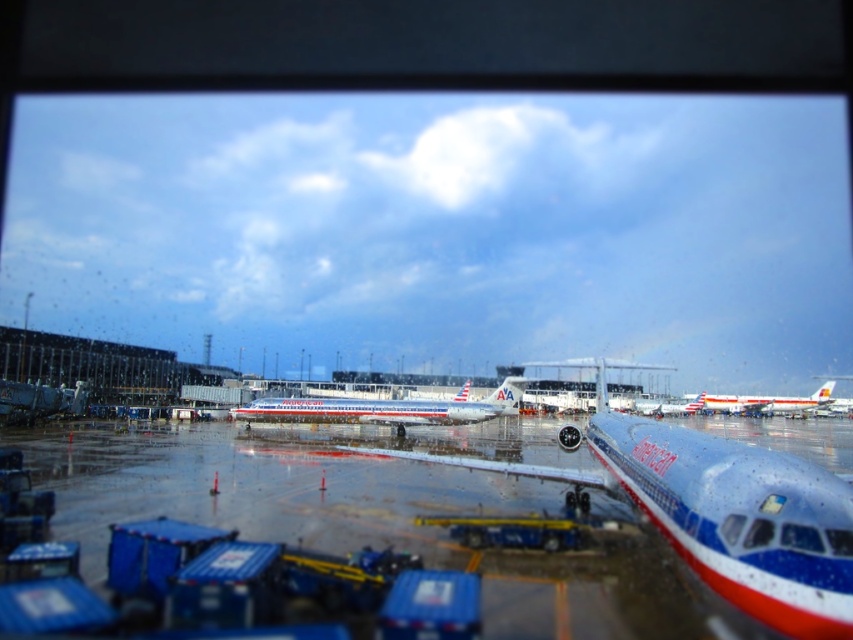
At what (x,y) coordinates should I click in order to perform the action: click on silver metallic airplane at center. Please return your answer as a coordinate pair (x, y). This screenshot has width=853, height=640. Looking at the image, I should click on (386, 408).

Between silver metallic airplane at center and white glossy airplane at center, which one appears on the right side from the viewer's perspective?

white glossy airplane at center

Identify the location of silver metallic airplane at center. (386, 408).